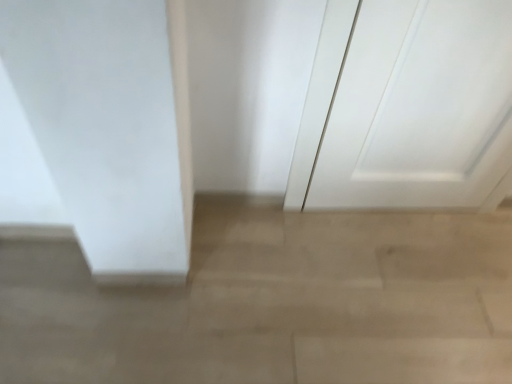
Where is `free space above beige polished concrete at center (from a real-world perspective)`? Image resolution: width=512 pixels, height=384 pixels. free space above beige polished concrete at center (from a real-world perspective) is located at coordinates (286, 288).